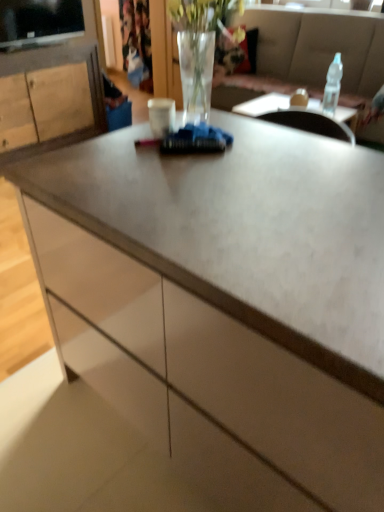
Question: Could wooden cabinet at left be considered to be inside clear glass vase at center?

Choices:
 (A) no
 (B) yes

Answer: (A)

Question: Can we say clear glass vase at center lies outside wooden cabinet at left?

Choices:
 (A) yes
 (B) no

Answer: (A)

Question: From a real-world perspective, is clear glass vase at center positioned over wooden cabinet at left based on gravity?

Choices:
 (A) yes
 (B) no

Answer: (A)

Question: Can you confirm if clear glass vase at center is thinner than wooden cabinet at left?

Choices:
 (A) yes
 (B) no

Answer: (A)

Question: Can you confirm if clear glass vase at center is taller than wooden cabinet at left?

Choices:
 (A) no
 (B) yes

Answer: (A)

Question: Is clear glass vase at center shorter than wooden cabinet at left?

Choices:
 (A) yes
 (B) no

Answer: (A)

Question: Considering the relative sizes of translucent glass vase at upper center and clear plastic bottle at upper right in the image provided, is translucent glass vase at upper center thinner than clear plastic bottle at upper right?

Choices:
 (A) yes
 (B) no

Answer: (B)

Question: Is translucent glass vase at upper center at the right side of clear plastic bottle at upper right?

Choices:
 (A) yes
 (B) no

Answer: (B)

Question: Is translucent glass vase at upper center next to clear plastic bottle at upper right?

Choices:
 (A) no
 (B) yes

Answer: (A)

Question: From a real-world perspective, is translucent glass vase at upper center on clear plastic bottle at upper right?

Choices:
 (A) no
 (B) yes

Answer: (A)

Question: Would you say translucent glass vase at upper center is outside clear plastic bottle at upper right?

Choices:
 (A) yes
 (B) no

Answer: (A)

Question: Could clear plastic bottle at upper right be considered to be inside translucent glass vase at upper center?

Choices:
 (A) no
 (B) yes

Answer: (A)

Question: From a real-world perspective, is clear glass vase at center positioned over translucent glass vase at upper center based on gravity?

Choices:
 (A) yes
 (B) no

Answer: (A)